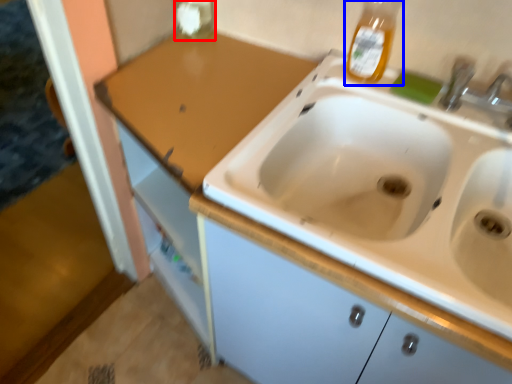
Question: Which of the following is the closest to the observer, bottle (highlighted by a red box) or bottle (highlighted by a blue box)?

Choices:
 (A) bottle
 (B) bottle

Answer: (B)